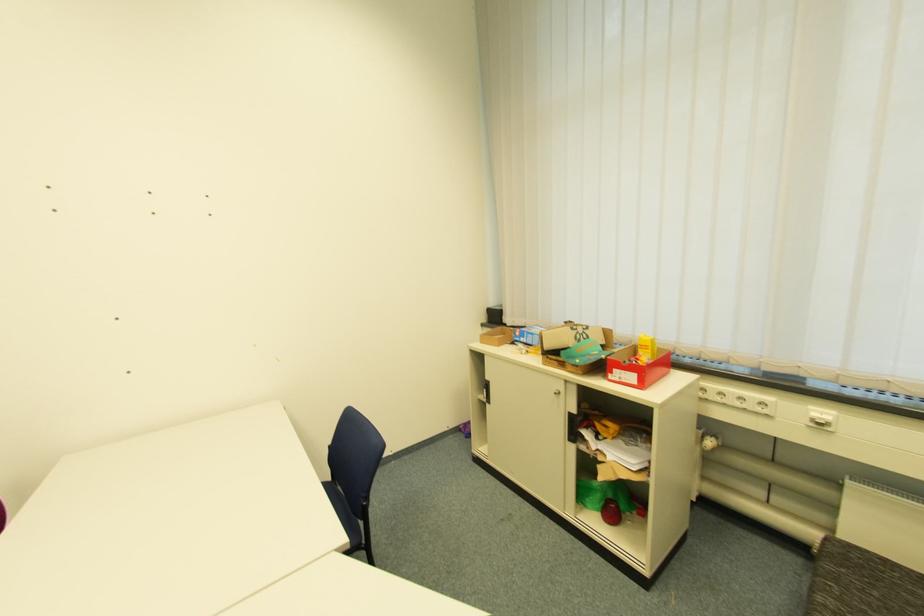
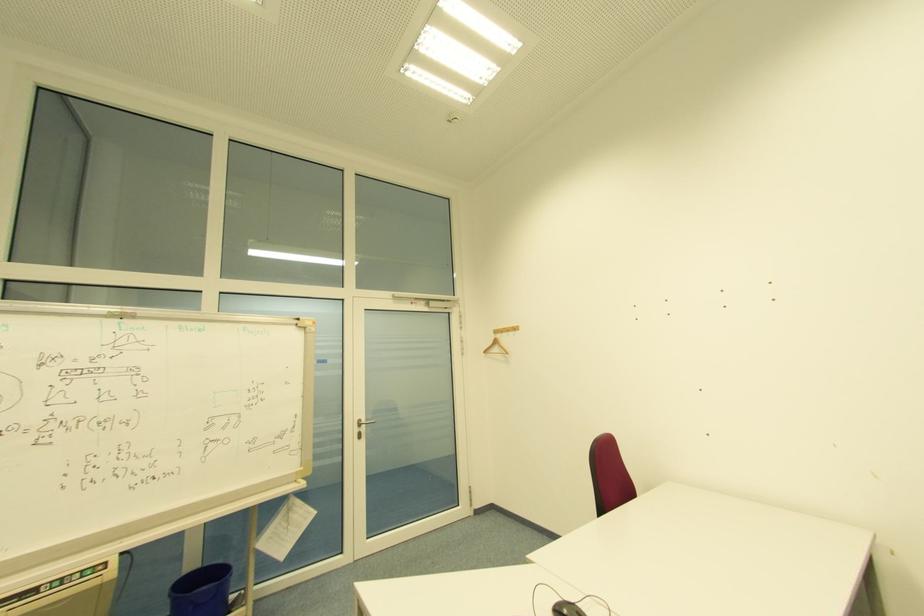
Question: The images are taken continuously from a first-person perspective. In which direction is your viewpoint rotating?

Choices:
 (A) Left
 (B) Right
 (C) Up
 (D) Down

Answer: (A)